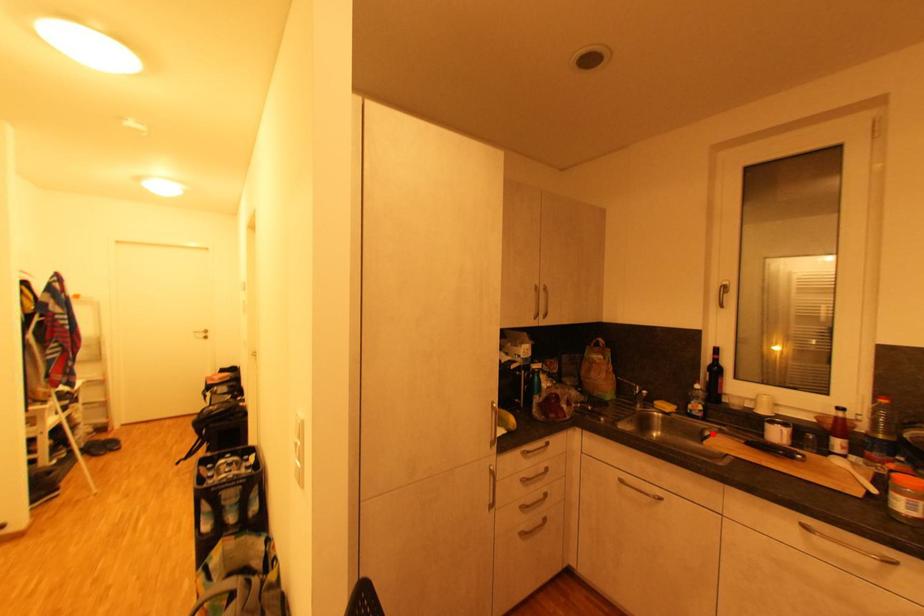
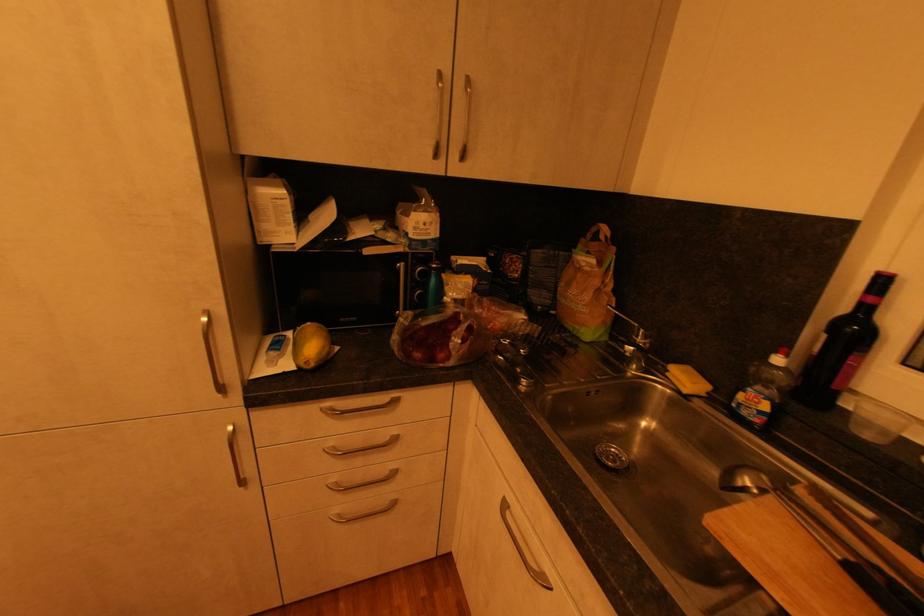
Where in the second image is the point corresponding to the highlighted location from the first image?

(749, 480)